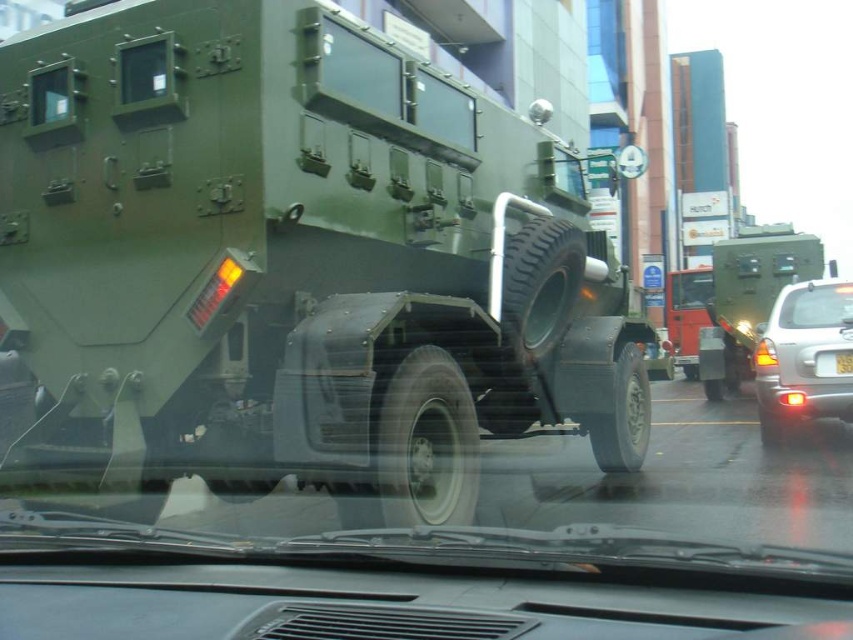
Based on the photo, you are driving a car and see the silver metallic car at right and the white plastic license plate at center in your rearview mirror. Which object is closer to your car?

The silver metallic car at right is closer to the viewer than the white plastic license plate at center, so the silver metallic car at right is closer to your car.

You are driving a car and see the transparent glass windshield at center ahead. Can you estimate its position in the image using coordinates?

The transparent glass windshield at center is located at coordinates point (816, 305).